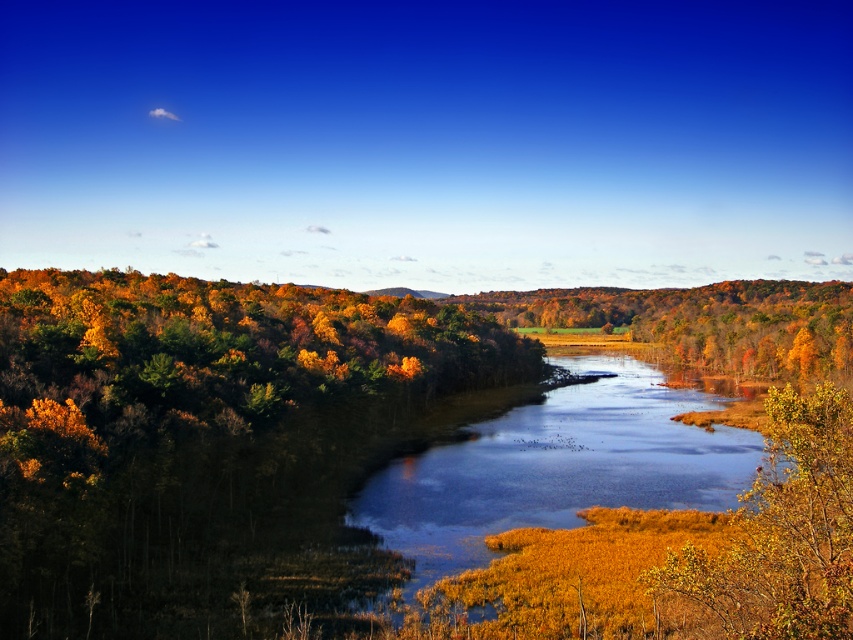
Question: Does golden grassy river at center have a smaller size compared to golden textured leaves at lower right?

Choices:
 (A) no
 (B) yes

Answer: (A)

Question: Can you confirm if golden grassy river at center is positioned above golden textured leaves at lower right?

Choices:
 (A) yes
 (B) no

Answer: (B)

Question: Which object appears farthest from the camera in this image?

Choices:
 (A) golden grassy river at center
 (B) golden textured leaves at lower right

Answer: (A)

Question: Does golden grassy river at center come in front of golden textured leaves at lower right?

Choices:
 (A) no
 (B) yes

Answer: (A)

Question: Which point is farther to the camera?

Choices:
 (A) golden textured leaves at lower right
 (B) golden grassy river at center

Answer: (B)